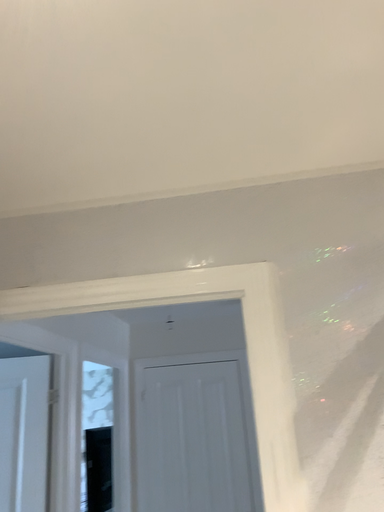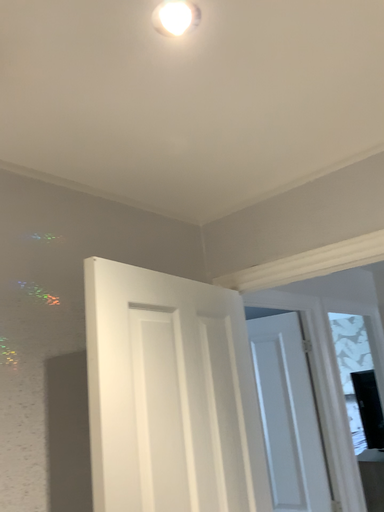
Question: Which way did the camera rotate in the video?

Choices:
 (A) rotated left
 (B) rotated right

Answer: (A)